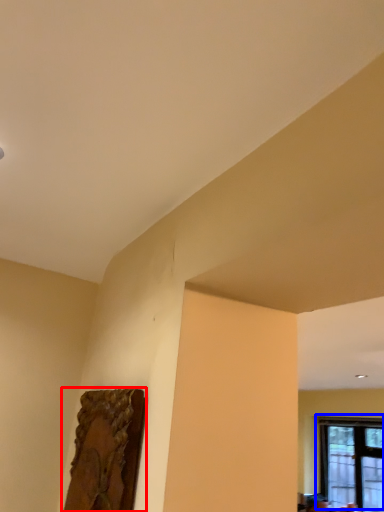
Question: Which of the following is the closest to the observer, picture frame (highlighted by a red box) or window (highlighted by a blue box)?

Choices:
 (A) picture frame
 (B) window

Answer: (A)